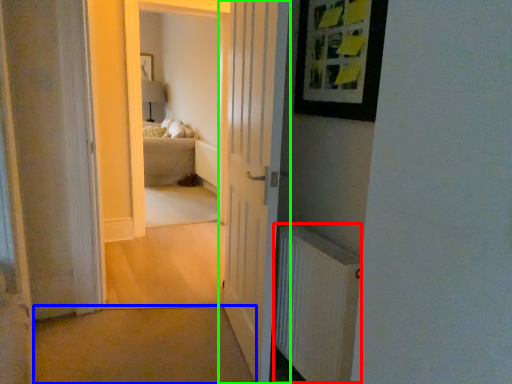
Question: Which object is positioned farthest from radiator (highlighted by a red box)? Select from path (highlighted by a blue box) and door (highlighted by a green box).

Choices:
 (A) path
 (B) door

Answer: (A)